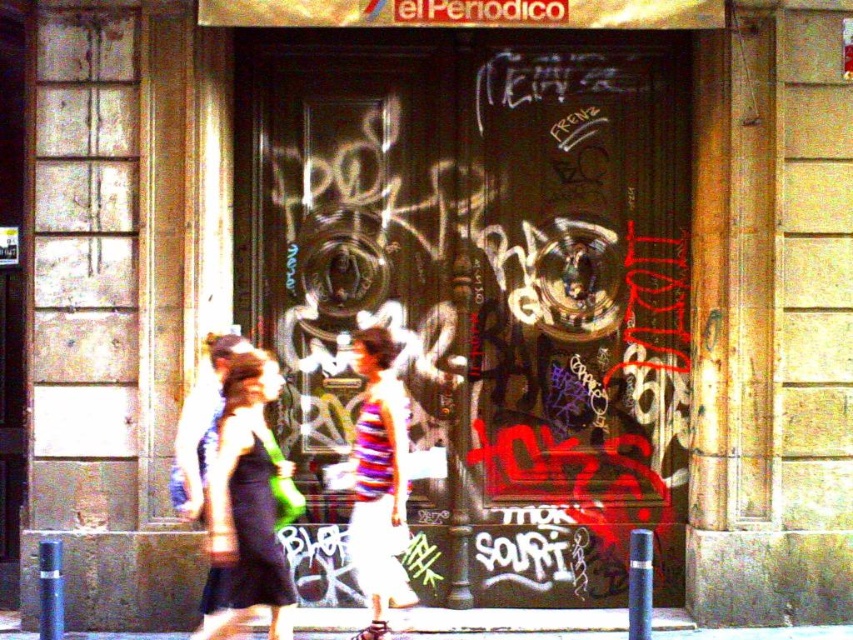
Does point (248, 577) lie in front of point (357, 508)?

Yes.

Which is above, matte black dress at center or striped fabric dress at center?

striped fabric dress at center

Between point (258, 486) and point (370, 532), which one is positioned in front?

Point (258, 486)

Locate an element on the screen. This screenshot has width=853, height=640. matte black dress at center is located at coordinates (247, 506).